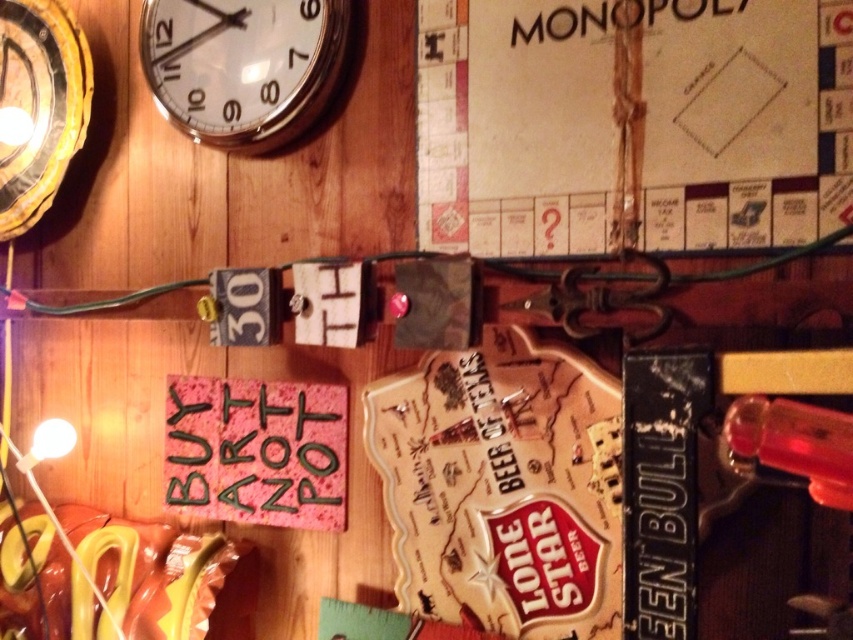
Question: Among these points, which one is farthest from the camera?

Choices:
 (A) (445, 118)
 (B) (335, 0)

Answer: (B)

Question: Does wooden monopoly game at upper right have a greater width compared to white glossy clock at upper left?

Choices:
 (A) yes
 (B) no

Answer: (A)

Question: Does wooden monopoly game at upper right have a larger size compared to white glossy clock at upper left?

Choices:
 (A) yes
 (B) no

Answer: (A)

Question: Does wooden monopoly game at upper right have a larger size compared to white glossy clock at upper left?

Choices:
 (A) no
 (B) yes

Answer: (B)

Question: Which object is closer to the camera taking this photo?

Choices:
 (A) white glossy clock at upper left
 (B) wooden monopoly game at upper right

Answer: (B)